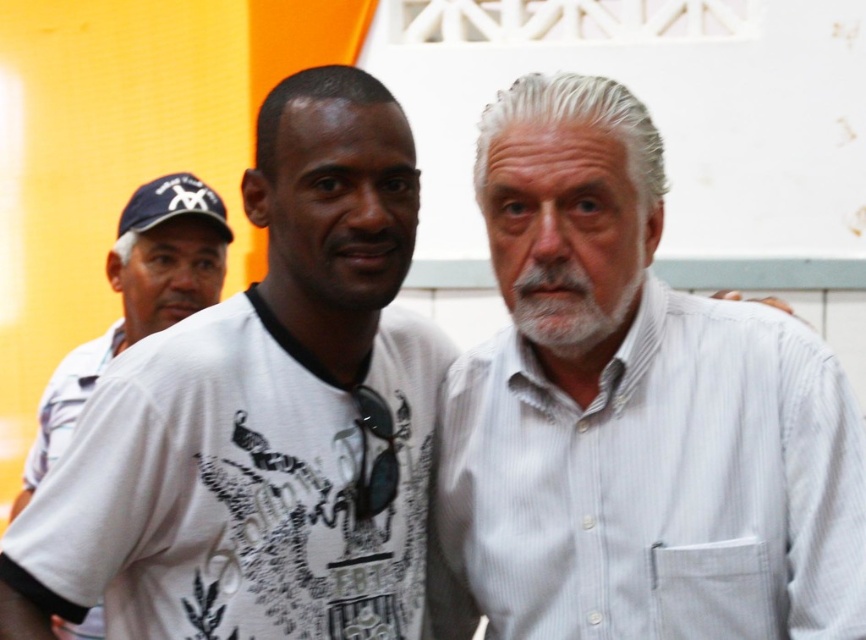
Question: Which is nearer to the matte blue baseball cap at upper left?

Choices:
 (A) white cotton shirt at left
 (B) white printed t-shirt at center

Answer: (A)

Question: In this image, where is whitehairbeard at center located relative to matte blue baseball cap at upper left?

Choices:
 (A) below
 (B) above

Answer: (A)

Question: Considering the real-world distances, which object is closest to the white cotton shirt at left?

Choices:
 (A) white printed t-shirt at center
 (B) matte blue baseball cap at upper left
 (C) whitehairbeard at center

Answer: (B)

Question: Which of the following is the closest to the observer?

Choices:
 (A) matte blue baseball cap at upper left
 (B) white printed t-shirt at center

Answer: (B)

Question: Can you confirm if white striped shirt at center is positioned to the left of white printed t-shirt at center?

Choices:
 (A) yes
 (B) no

Answer: (B)

Question: Does white striped shirt at center have a greater width compared to matte blue baseball cap at upper left?

Choices:
 (A) yes
 (B) no

Answer: (A)